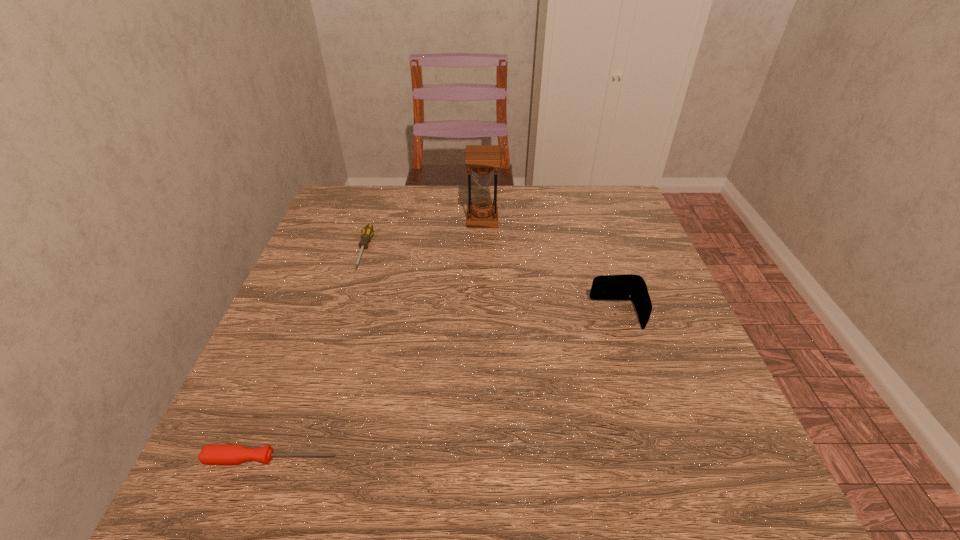
Where is `vacant space that satisfies the following two spatial constraints: 1. at the tip of the taller screwdriver; 2. at the tip of the shortest object`? Image resolution: width=960 pixels, height=540 pixels. vacant space that satisfies the following two spatial constraints: 1. at the tip of the taller screwdriver; 2. at the tip of the shortest object is located at coordinates (297, 458).

Locate an element on the screen. vacant space that satisfies the following two spatial constraints: 1. on the front side of the tallest object; 2. at the tip of the nearest object is located at coordinates (484, 458).